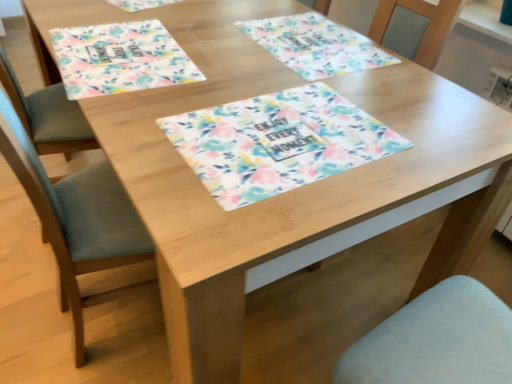
Where is `blank space to the left of floral fabric placemat at center`? Image resolution: width=512 pixels, height=384 pixels. blank space to the left of floral fabric placemat at center is located at coordinates (143, 102).